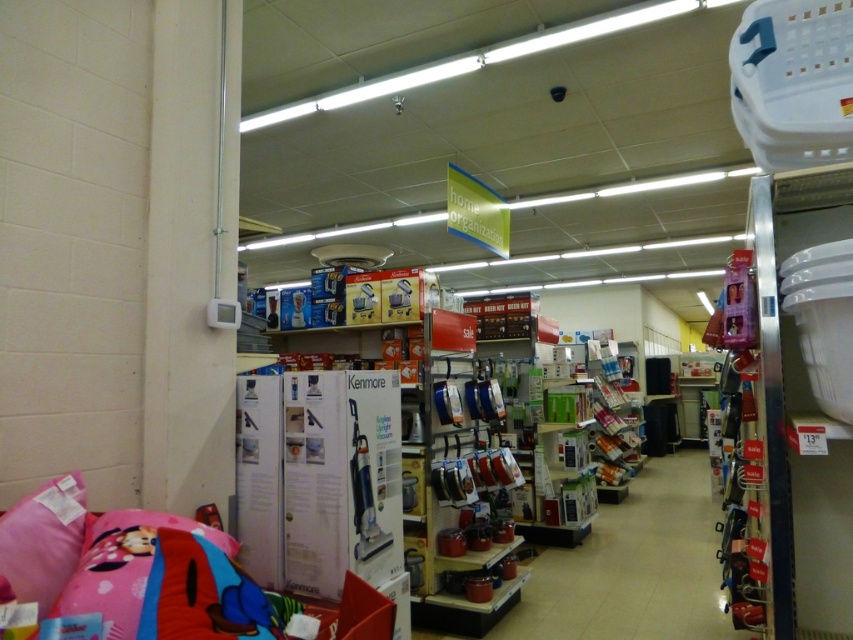
Question: Is matte pink pillow at lower left further to the viewer compared to pink fabric pillow at lower left?

Choices:
 (A) no
 (B) yes

Answer: (A)

Question: Does matte pink pillow at lower left have a larger size compared to pink fabric pillow at lower left?

Choices:
 (A) no
 (B) yes

Answer: (B)

Question: Which point appears closest to the camera in this image?

Choices:
 (A) (202, 560)
 (B) (44, 561)

Answer: (A)

Question: Can you confirm if matte pink pillow at lower left is positioned to the left of pink fabric pillow at lower left?

Choices:
 (A) yes
 (B) no

Answer: (B)